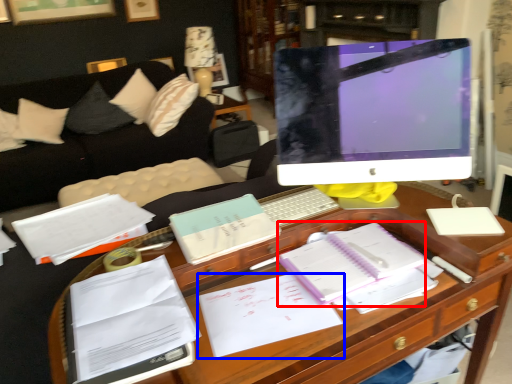
Question: Which object appears closest to the camera in this image, notebook (highlighted by a red box) or document (highlighted by a blue box)?

Choices:
 (A) notebook
 (B) document

Answer: (B)